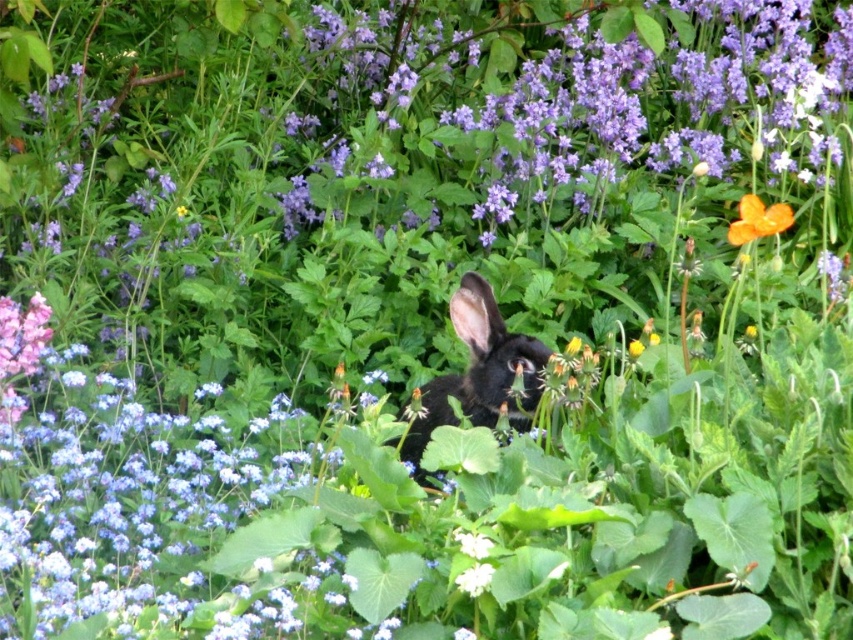
Question: Which point is closer to the camera taking this photo?

Choices:
 (A) (737, 237)
 (B) (497, 358)

Answer: (B)

Question: Which point is closer to the camera taking this photo?

Choices:
 (A) (776, 220)
 (B) (421, 419)

Answer: (B)

Question: From the image, what is the correct spatial relationship of black furry rabbit at center in relation to orange matte flower at upper right?

Choices:
 (A) below
 (B) above

Answer: (A)

Question: Is black furry rabbit at center thinner than orange matte flower at upper right?

Choices:
 (A) yes
 (B) no

Answer: (B)

Question: Among these objects, which one is nearest to the camera?

Choices:
 (A) orange matte flower at upper right
 (B) black furry rabbit at center

Answer: (B)

Question: Is the position of black furry rabbit at center more distant than that of orange matte flower at upper right?

Choices:
 (A) no
 (B) yes

Answer: (A)